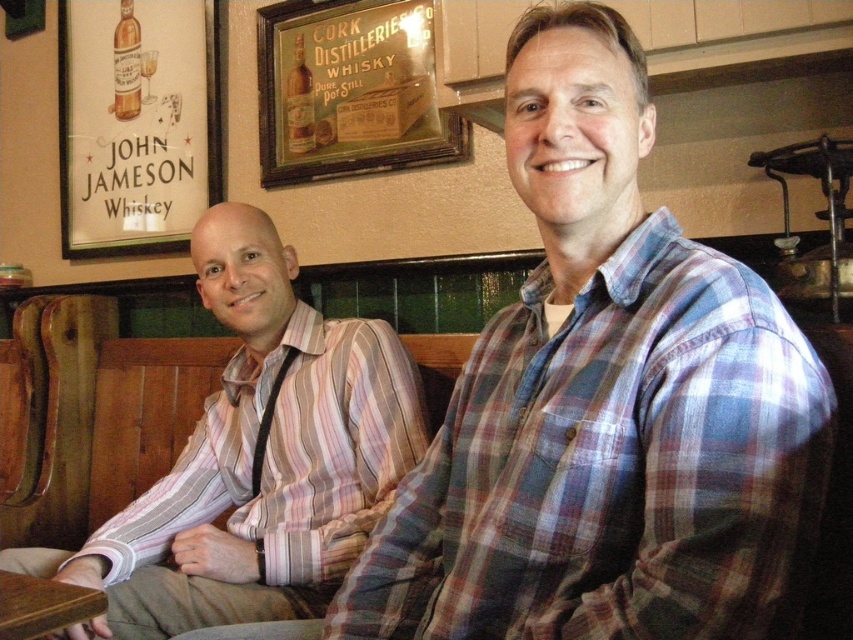
Based on the photo, who is positioned more to the right, plaid cotton shirt at center or pink striped shirt at left?

Positioned to the right is plaid cotton shirt at center.

Is plaid cotton shirt at center above pink striped shirt at left?

Correct, plaid cotton shirt at center is located above pink striped shirt at left.

Locate an element on the screen. Image resolution: width=853 pixels, height=640 pixels. plaid cotton shirt at center is located at coordinates (606, 404).

Between plaid cotton shirt at center and brown wooden table at lower left, which one has less height?

brown wooden table at lower left is shorter.

Does plaid cotton shirt at center appear over brown wooden table at lower left?

Yes, plaid cotton shirt at center is above brown wooden table at lower left.

Between point (556, 12) and point (38, 580), which one is positioned behind?

Positioned behind is point (38, 580).

The image size is (853, 640). In order to click on plaid cotton shirt at center in this screenshot , I will do `click(606, 404)`.

Which of these two, pink striped shirt at left or brown wooden table at lower left, stands taller?

pink striped shirt at left is taller.

Can you confirm if pink striped shirt at left is taller than brown wooden table at lower left?

Correct, pink striped shirt at left is much taller as brown wooden table at lower left.

Measure the distance between point (148, 502) and camera.

The distance of point (148, 502) from camera is 1.48 meters.

This screenshot has width=853, height=640. I want to click on pink striped shirt at left, so click(263, 454).